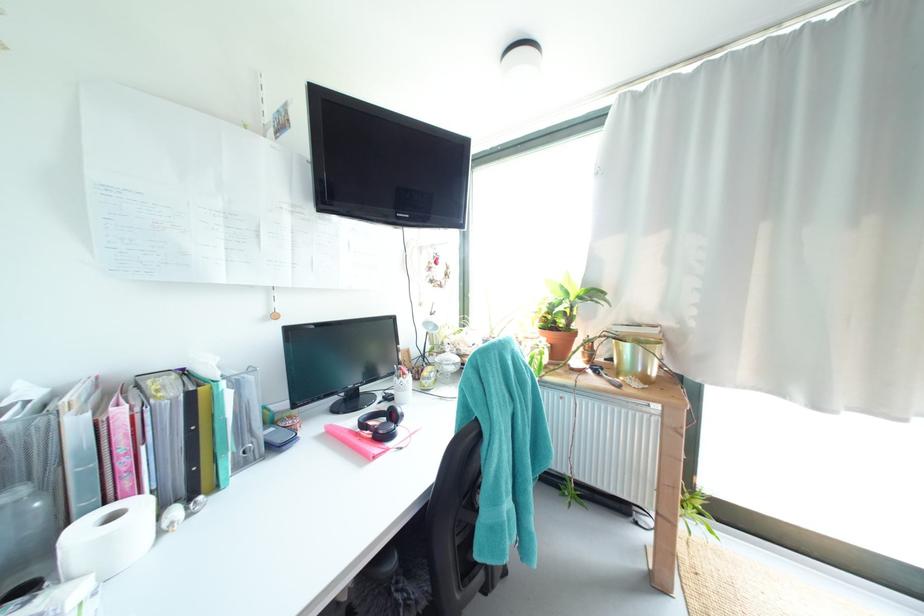
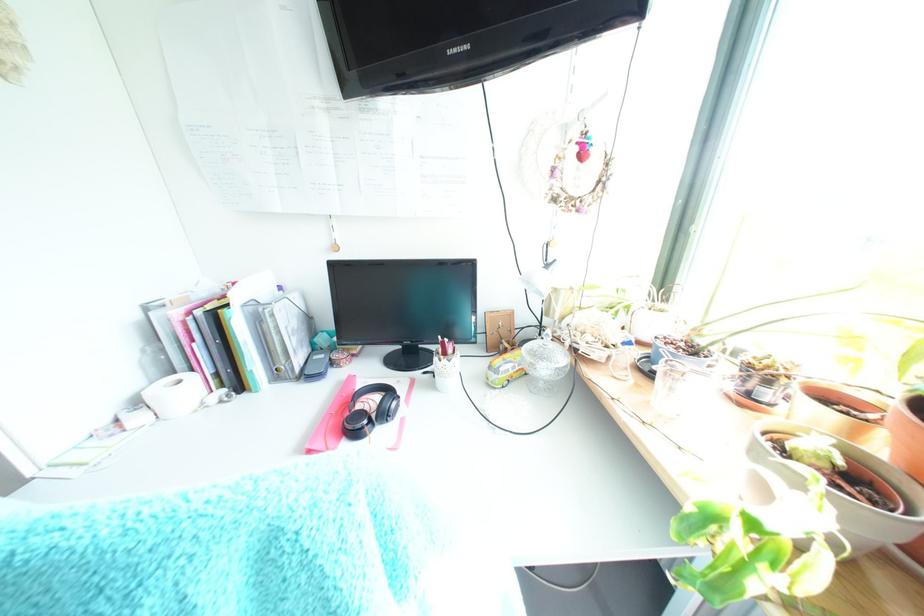
The images are taken continuously from a first-person perspective. In which direction is your viewpoint rotating?

The camera rotated toward left-down.